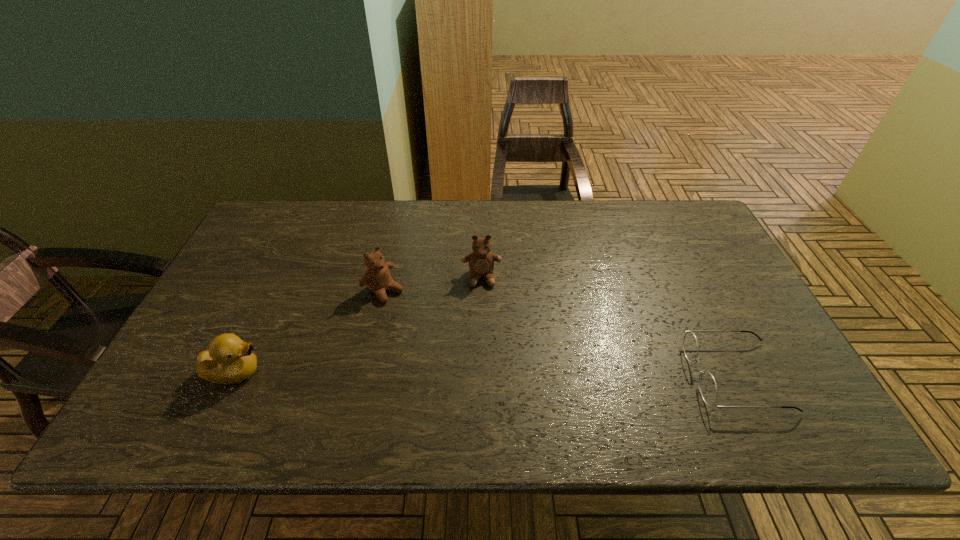
You are a GUI agent. You are given a task and a screenshot of the screen. Output one action in this format:
    pyautogui.click(x=<x>, y=<y>)
    Task: Click on the free space located on the face of the second object from left to right
    The image size is (960, 540).
    Given the screenshot: What is the action you would take?
    pyautogui.click(x=480, y=366)

Locate an element on the screen. The image size is (960, 540). free region located 0.310m on the face of the second object from left to right is located at coordinates (480, 366).

This screenshot has height=540, width=960. What are the coordinates of `free space located 0.300m on the front-facing side of the second object from right to left` in the screenshot? It's located at (487, 382).

Identify the location of free space located on the front-facing side of the second object from right to left. The width and height of the screenshot is (960, 540). (485, 347).

This screenshot has width=960, height=540. In order to click on vacant region located 0.120m on the front-facing side of the second object from right to left in this screenshot , I will do `click(484, 322)`.

Find the location of a particular element. duckling situated at the near edge is located at coordinates (229, 360).

Image resolution: width=960 pixels, height=540 pixels. What are the coordinates of `spectacles that is at the near edge` in the screenshot? It's located at (707, 385).

Where is `object located at the left edge`? Image resolution: width=960 pixels, height=540 pixels. object located at the left edge is located at coordinates (229, 360).

The image size is (960, 540). I want to click on object at the right edge, so click(707, 385).

At what (x,y) coordinates should I click in order to perform the action: click on object situated at the near left corner. Please return your answer as a coordinate pair (x, y). The width and height of the screenshot is (960, 540). Looking at the image, I should click on (229, 360).